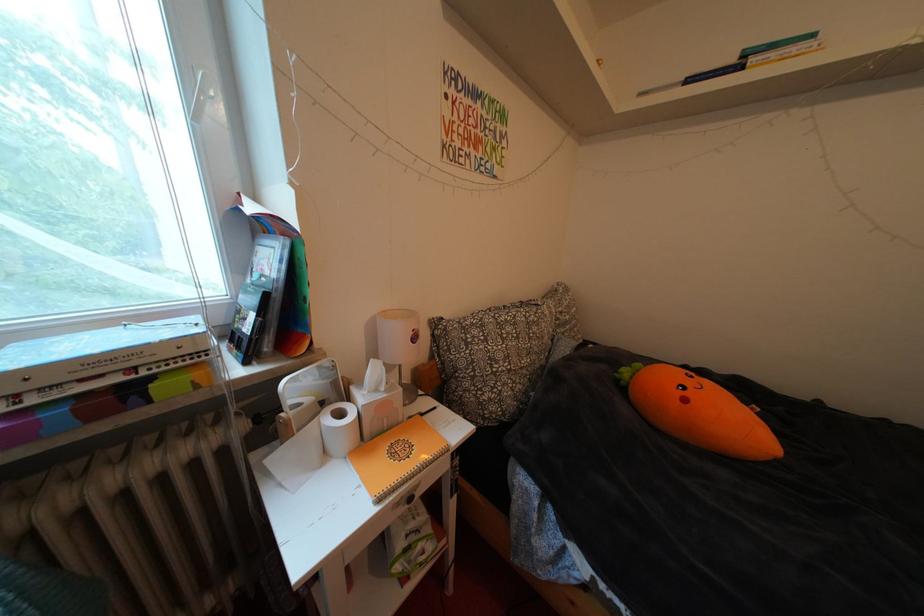
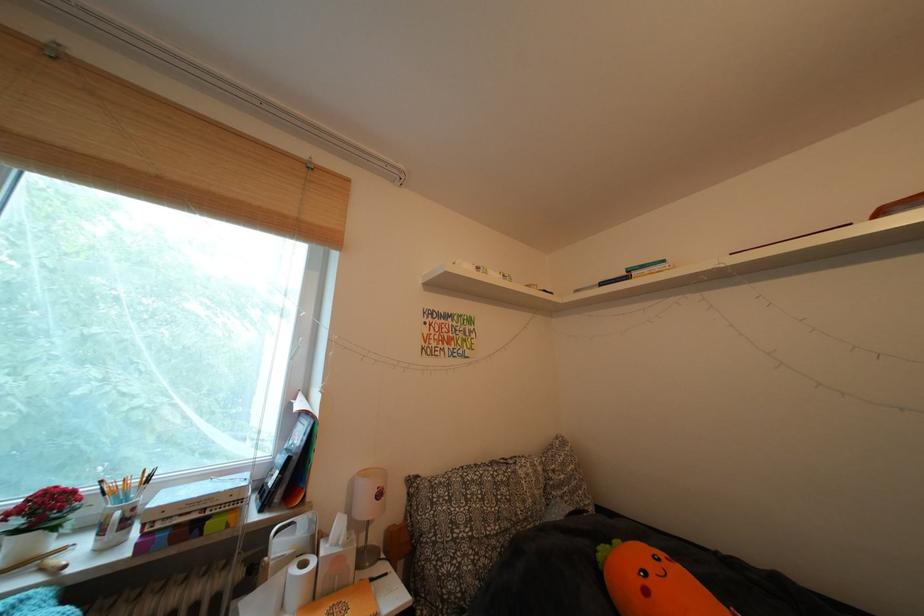
In the second image, find the point that corresponds to pixel 390 410 in the first image.

(346, 565)